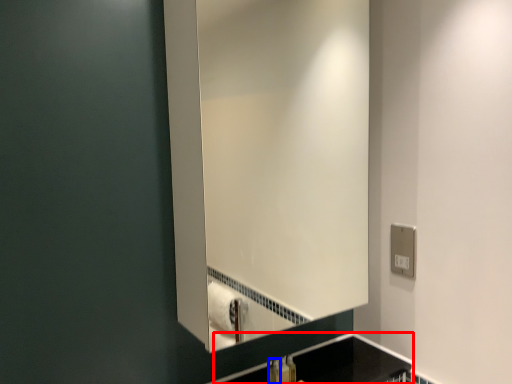
Question: Among these objects, which one is farthest to the camera, counter top (highlighted by a red box) or toiletry (highlighted by a blue box)?

Choices:
 (A) counter top
 (B) toiletry

Answer: (B)